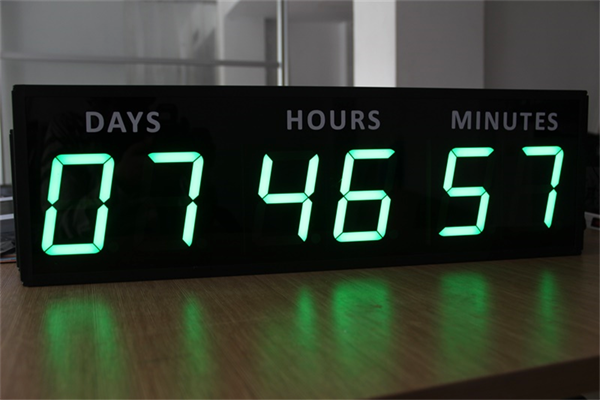
You are a GUI agent. You are given a task and a screenshot of the screen. Output one action in this format:
    pyautogui.click(x=<x>, y=<y>)
    Task: Click on the window
    The height and width of the screenshot is (400, 600).
    Given the screenshot: What is the action you would take?
    [x=166, y=34]